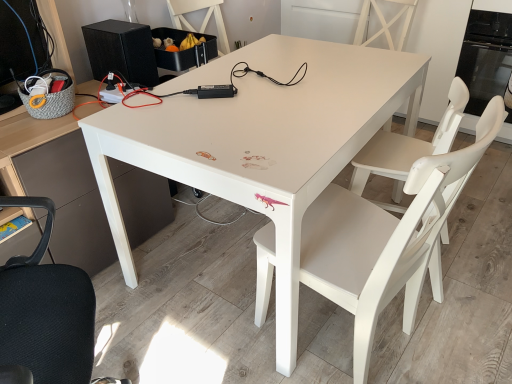
The image size is (512, 384). Find the location of `vacant area located to the right-hand side of white matte chair at center`. vacant area located to the right-hand side of white matte chair at center is located at coordinates (464, 322).